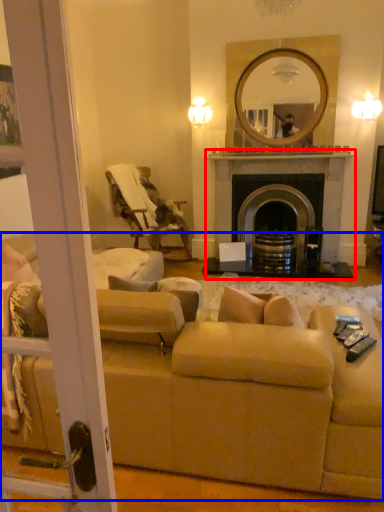
Question: Which of the following is the farthest to the observer, fireplace (highlighted by a red box) or studio couch (highlighted by a blue box)?

Choices:
 (A) fireplace
 (B) studio couch

Answer: (A)